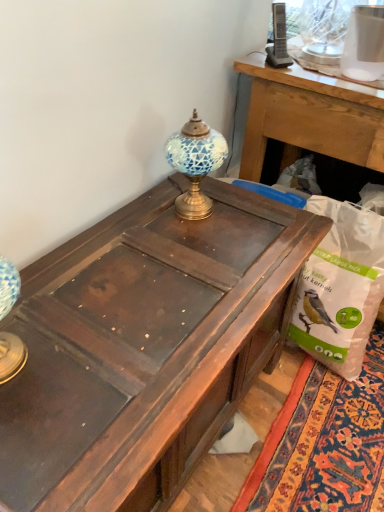
Where is `vacant area to the left of blue mosaic glass at center`? This screenshot has width=384, height=512. vacant area to the left of blue mosaic glass at center is located at coordinates (144, 210).